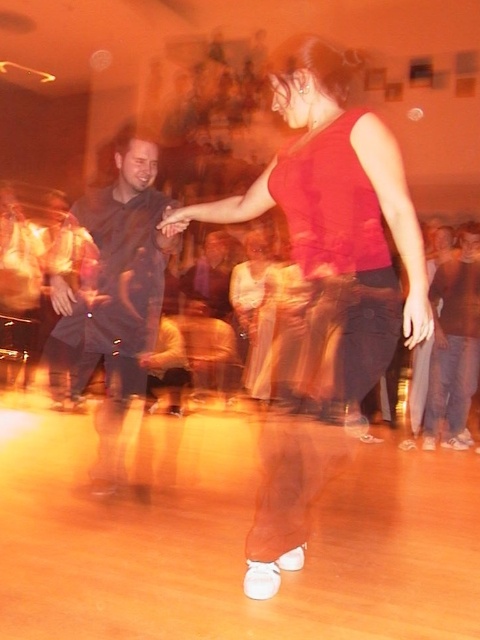
Question: Among these points, which one is nearest to the camera?

Choices:
 (A) (453, 328)
 (B) (369, 387)

Answer: (B)

Question: Is matte red tank top at center further to the viewer compared to dark blue jeans at center?

Choices:
 (A) no
 (B) yes

Answer: (A)

Question: Can you confirm if dark blue fabric shirt at left is thinner than dark blue jeans at center?

Choices:
 (A) no
 (B) yes

Answer: (A)

Question: Is matte red tank top at center below dark blue jeans at center?

Choices:
 (A) yes
 (B) no

Answer: (B)

Question: Among these points, which one is nearest to the camera?

Choices:
 (A) (118, 291)
 (B) (432, 378)

Answer: (A)

Question: Which object is farther from the camera taking this photo?

Choices:
 (A) dark blue fabric shirt at left
 (B) dark blue jeans at center
 (C) matte red tank top at center

Answer: (B)